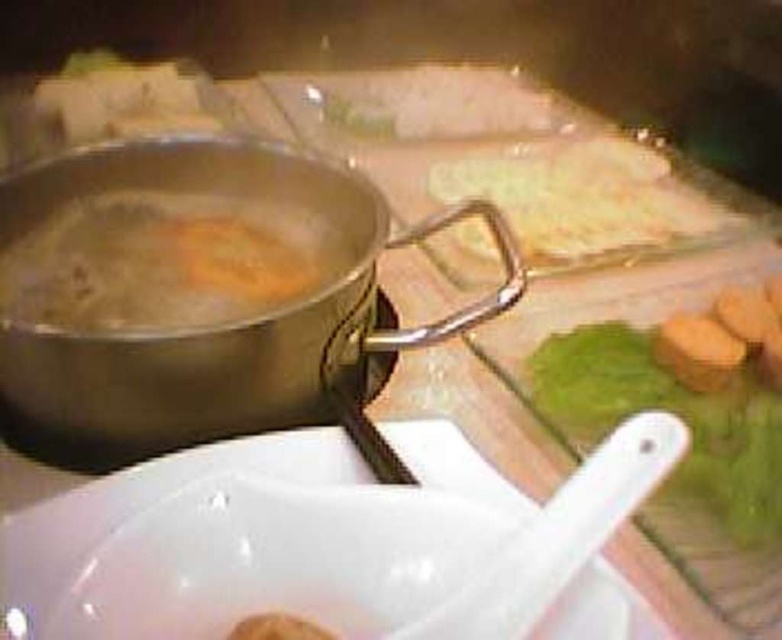
Describe the element at coordinates (153, 264) in the screenshot. I see `orange soft bread at center` at that location.

Image resolution: width=782 pixels, height=640 pixels. Describe the element at coordinates (153, 264) in the screenshot. I see `orange soft bread at center` at that location.

The height and width of the screenshot is (640, 782). What are the coordinates of `orange soft bread at center` in the screenshot? It's located at pyautogui.click(x=153, y=264).